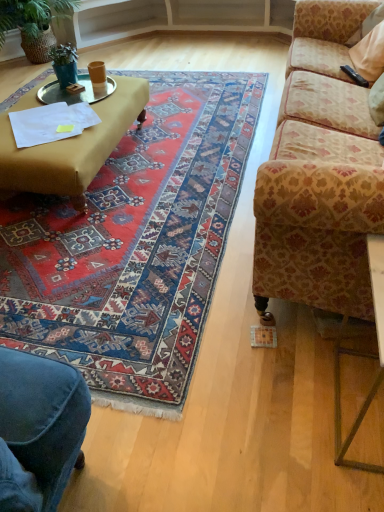
Question: Is green matte plant at upper left, the 2th houseplant in the top-to-bottom sequence, positioned beyond the bounds of green woven basket at upper left, the second houseplant ordered from the bottom?

Choices:
 (A) no
 (B) yes

Answer: (B)

Question: From the image's perspective, would you say green matte plant at upper left, which is the 1th houseplant from right to left, is positioned over green woven basket at upper left, placed as the 1th houseplant when sorted from top to bottom?

Choices:
 (A) yes
 (B) no

Answer: (B)

Question: From the image's perspective, is green matte plant at upper left, which ranks as the second houseplant in left-to-right order, located beneath green woven basket at upper left, acting as the 2th houseplant starting from the right?

Choices:
 (A) yes
 (B) no

Answer: (A)

Question: Considering the relative sizes of green matte plant at upper left, which ranks as the second houseplant in left-to-right order, and green woven basket at upper left, placed as the 1th houseplant when sorted from top to bottom, in the image provided, is green matte plant at upper left, which ranks as the second houseplant in left-to-right order, bigger than green woven basket at upper left, placed as the 1th houseplant when sorted from top to bottom,?

Choices:
 (A) yes
 (B) no

Answer: (B)

Question: From a real-world perspective, is green matte plant at upper left, arranged as the 1th houseplant when ordered from the bottom, below green woven basket at upper left, acting as the 2th houseplant starting from the right?

Choices:
 (A) no
 (B) yes

Answer: (A)

Question: Are green matte plant at upper left, which is the 1th houseplant from right to left, and green woven basket at upper left, the second houseplant ordered from the bottom, making contact?

Choices:
 (A) no
 (B) yes

Answer: (A)

Question: Is carpet with intricate patterns at center looking in the opposite direction of matte yellow ottoman at left?

Choices:
 (A) no
 (B) yes

Answer: (A)

Question: Considering the relative positions of carpet with intricate patterns at center and matte yellow ottoman at left in the image provided, is carpet with intricate patterns at center to the left of matte yellow ottoman at left from the viewer's perspective?

Choices:
 (A) yes
 (B) no

Answer: (B)

Question: Considering the relative sizes of carpet with intricate patterns at center and matte yellow ottoman at left in the image provided, is carpet with intricate patterns at center bigger than matte yellow ottoman at left?

Choices:
 (A) yes
 (B) no

Answer: (A)

Question: Is the position of carpet with intricate patterns at center less distant than that of matte yellow ottoman at left?

Choices:
 (A) yes
 (B) no

Answer: (A)

Question: Is matte yellow ottoman at left completely or partially inside carpet with intricate patterns at center?

Choices:
 (A) yes
 (B) no

Answer: (B)

Question: Can you confirm if carpet with intricate patterns at center is smaller than matte yellow ottoman at left?

Choices:
 (A) no
 (B) yes

Answer: (A)

Question: Is metallic gold table at lower right smaller than green woven basket at upper left, the first houseplant in the back-to-front sequence?

Choices:
 (A) yes
 (B) no

Answer: (A)